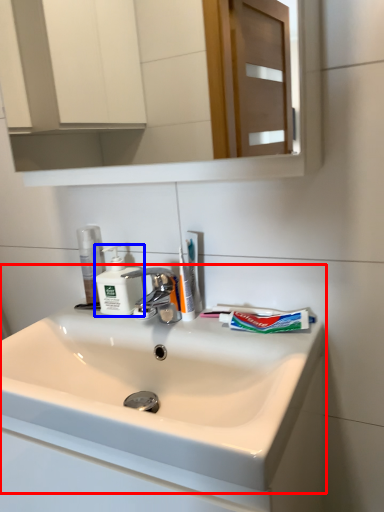
Question: Which object appears closest to the camera in this image, sink (highlighted by a red box) or soap dispenser (highlighted by a blue box)?

Choices:
 (A) sink
 (B) soap dispenser

Answer: (A)